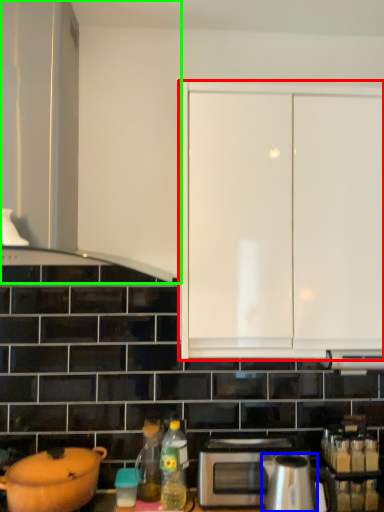
Question: Based on their relative distances, which object is farther from cabinetry (highlighted by a red box)? Choose from kitchen appliance (highlighted by a blue box) and cabinetry (highlighted by a green box).

Choices:
 (A) kitchen appliance
 (B) cabinetry

Answer: (A)